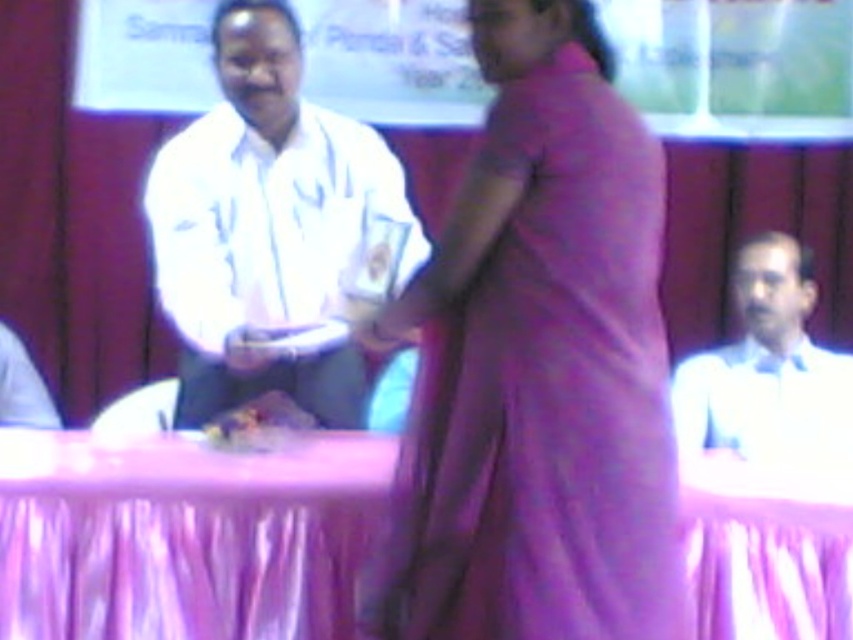
Question: Which object is closer to the camera taking this photo?

Choices:
 (A) smooth plastic food at center
 (B) purple fabric dress at center
 (C) white glossy shirt at center
 (D) purple fabric table at center

Answer: (B)

Question: From the image, what is the correct spatial relationship of purple fabric dress at center in relation to smooth plastic food at center?

Choices:
 (A) above
 (B) below

Answer: (A)

Question: Among these objects, which one is farthest from the camera?

Choices:
 (A) white glossy shirt at center
 (B) purple fabric table at center
 (C) white shirt at right

Answer: (A)

Question: Does purple fabric table at center have a lesser width compared to white glossy shirt at center?

Choices:
 (A) yes
 (B) no

Answer: (B)

Question: Is purple fabric dress at center smaller than white glossy shirt at center?

Choices:
 (A) yes
 (B) no

Answer: (A)

Question: Which object appears closest to the camera in this image?

Choices:
 (A) purple fabric table at center
 (B) purple fabric dress at center

Answer: (B)